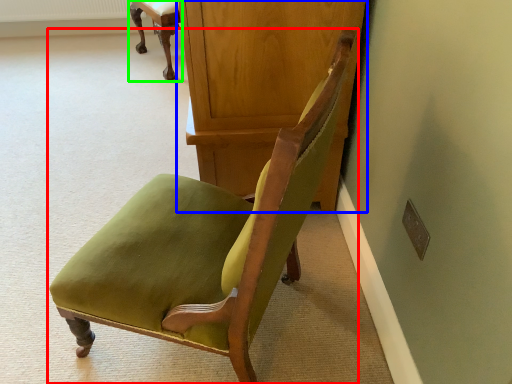
Question: Estimate the real-world distances between objects in this image. Which object is closer to chair (highlighted by a red box), dresser (highlighted by a blue box) or chair (highlighted by a green box)?

Choices:
 (A) dresser
 (B) chair

Answer: (A)